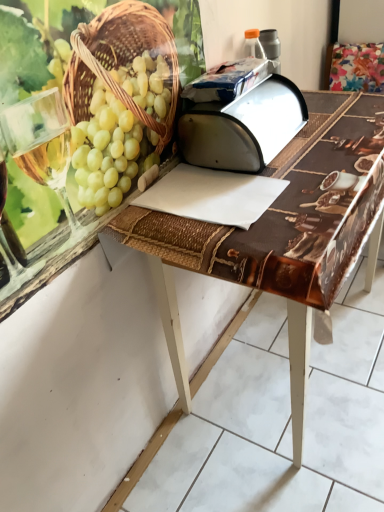
You are a GUI agent. You are given a task and a screenshot of the screen. Output one action in this format:
    pyautogui.click(x=<x>, y=<y>)
    Task: Click on the vacant area on top of brown woven table at center (from a real-world perspective)
    The height and width of the screenshot is (512, 384).
    Given the screenshot: What is the action you would take?
    pyautogui.click(x=285, y=163)